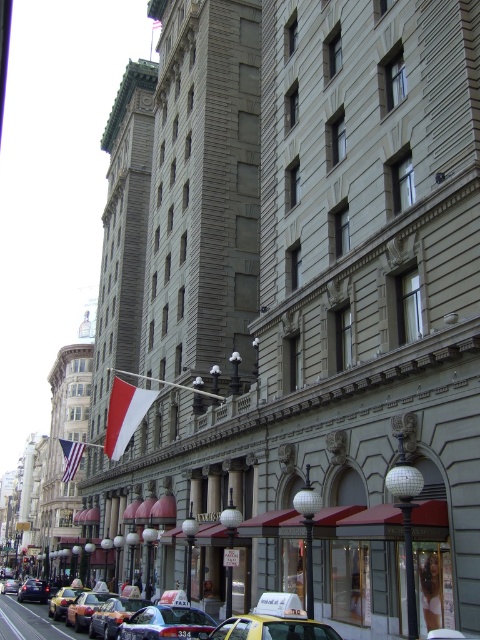
You are a pedestrian standing on the street looking up at the building. You see the white fabric flag at center and the metallic taxi cab at center. Which object is higher in the scene?

The white fabric flag at center is positioned over the metallic taxi cab at center, so it is higher.

In the scene shown: You are a delivery person who needs to load a large package onto the roof of one of the taxis. Which taxi, the yellow metallic taxi at center or the metallic silver taxi cab at center, would allow you to place the package on its roof without it touching the street awnings above?

The yellow metallic taxi at center has a lesser height compared to metallic silver taxi cab at center, so the yellow metallic taxi at center would allow you to place the package on its roof without it touching the street awnings above.

You are a pedestrian standing at the yellow metallic taxi at lower left. You want to walk to the american flag at center. How many steps would you need to take to reach it?

The distance between the american flag at center and the yellow metallic taxi at lower left is 39.02 meters. Assuming an average step length of 0.762 meters, you would need approximately 51 steps to reach the flag.